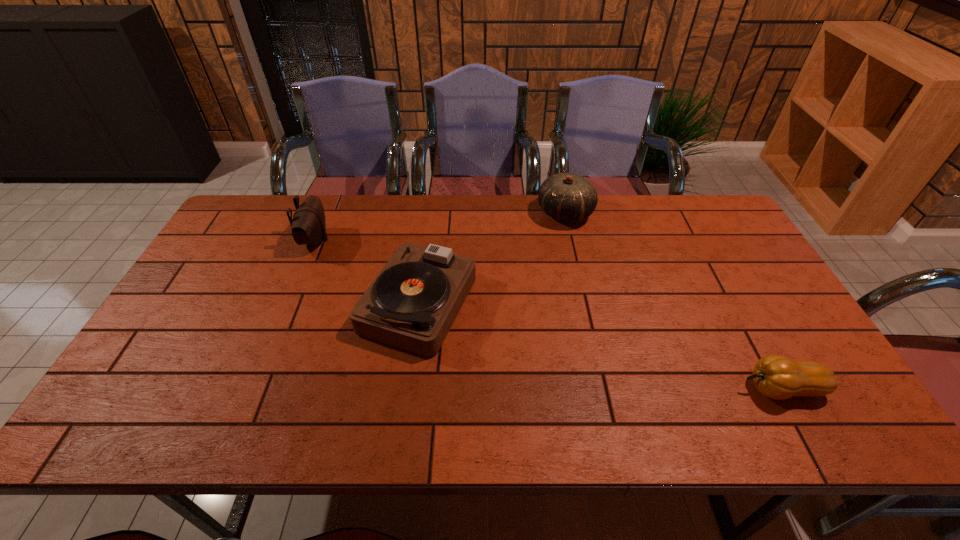
Where is `blank region between the farther gourd and the right gourd`? The height and width of the screenshot is (540, 960). blank region between the farther gourd and the right gourd is located at coordinates (673, 301).

This screenshot has width=960, height=540. What are the coordinates of `free space between the farther gourd and the pouch` in the screenshot? It's located at (440, 227).

In order to click on free spot between the leftmost object and the second object from left to right in this screenshot , I will do `click(367, 271)`.

Choose which object is the second nearest neighbor to the right gourd. Please provide its 2D coordinates. Your answer should be formatted as a tuple, i.e. [(x, y)], where the tuple contains the x and y coordinates of a point satisfying the conditions above.

[(412, 303)]

Find the location of `object that can be found as the second closest to the pouch`. object that can be found as the second closest to the pouch is located at coordinates (568, 197).

I want to click on vacant space that satisfies the following two spatial constraints: 1. on the back side of the farther gourd; 2. on the right side of the second object from left to right, so click(x=431, y=213).